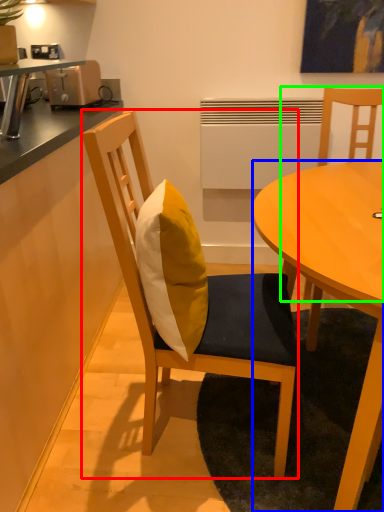
Question: Which object is the closest to the chair (highlighted by a red box)? Choose among these: desk (highlighted by a blue box) or chair (highlighted by a green box).

Choices:
 (A) desk
 (B) chair

Answer: (A)